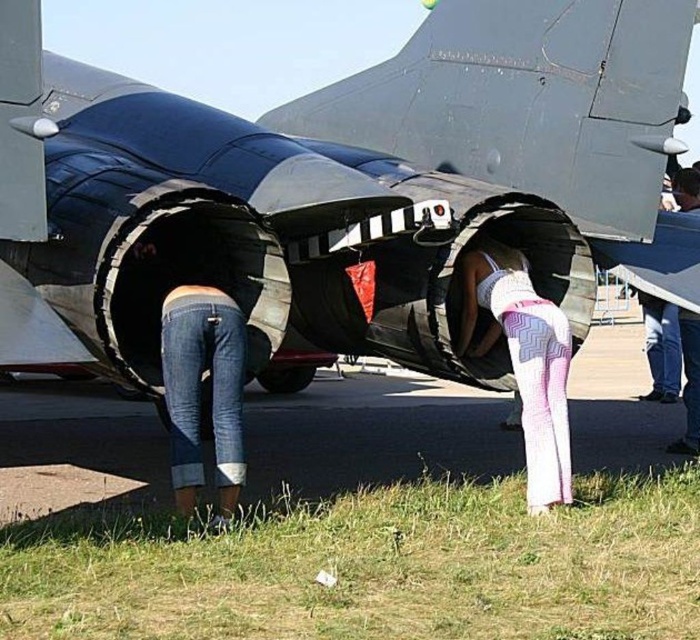
Question: Which point is closer to the camera?

Choices:
 (A) (679, 227)
 (B) (626, 404)

Answer: (A)

Question: Is black asphalt at lower center positioned behind pink/white textured leggings at lower center?

Choices:
 (A) no
 (B) yes

Answer: (A)

Question: Among these points, which one is farthest from the camera?

Choices:
 (A) (216, 424)
 (B) (542, 321)
 (C) (638, 428)

Answer: (C)

Question: Is black asphalt at lower center wider than pink/white textured leggings at lower center?

Choices:
 (A) yes
 (B) no

Answer: (A)

Question: Which object is farther from the camera taking this photo?

Choices:
 (A) pink/white textured leggings at lower center
 (B) jeans at lower left
 (C) metallic gray jet engine at center
 (D) black asphalt at lower center

Answer: (A)

Question: From the image, what is the correct spatial relationship of black asphalt at lower center in relation to pink/white textured leggings at lower center?

Choices:
 (A) left
 (B) right

Answer: (A)